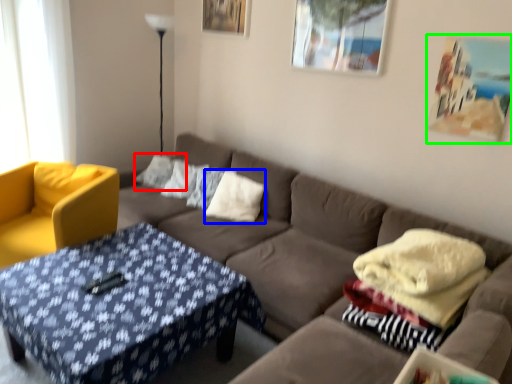
Question: Which object is positioned closest to pillow (highlighted by a red box)? Select from pillow (highlighted by a blue box) and picture frame (highlighted by a green box).

Choices:
 (A) pillow
 (B) picture frame

Answer: (A)